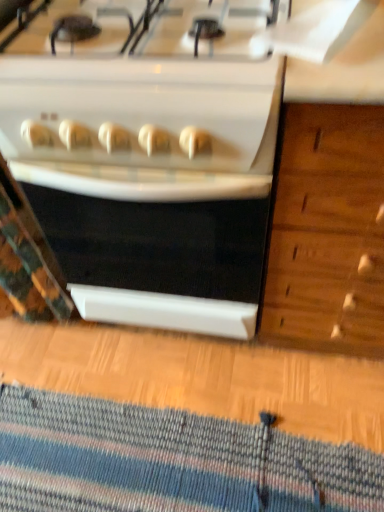
Locate an element on the screen. The image size is (384, 512). vacant area that is in front of white glossy stove at center is located at coordinates (196, 423).